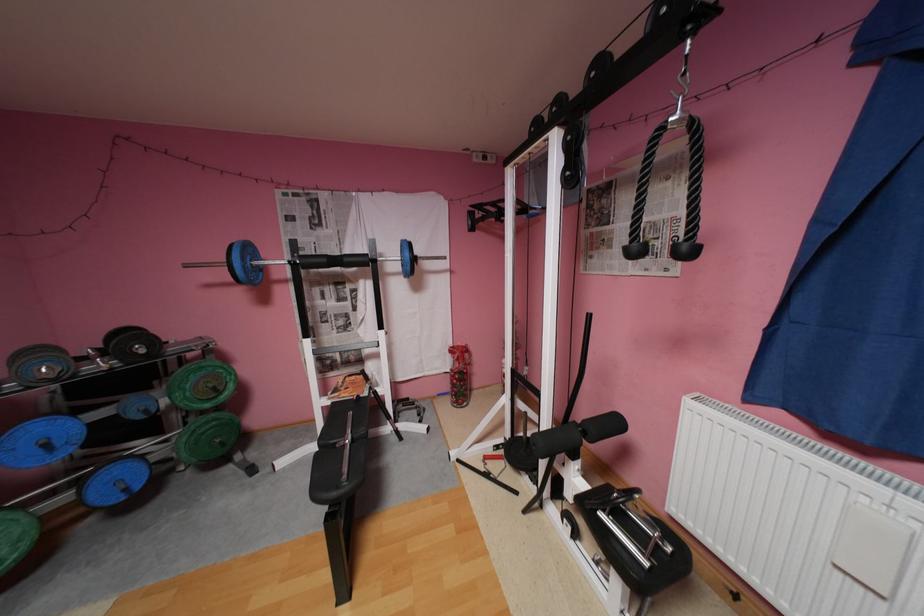
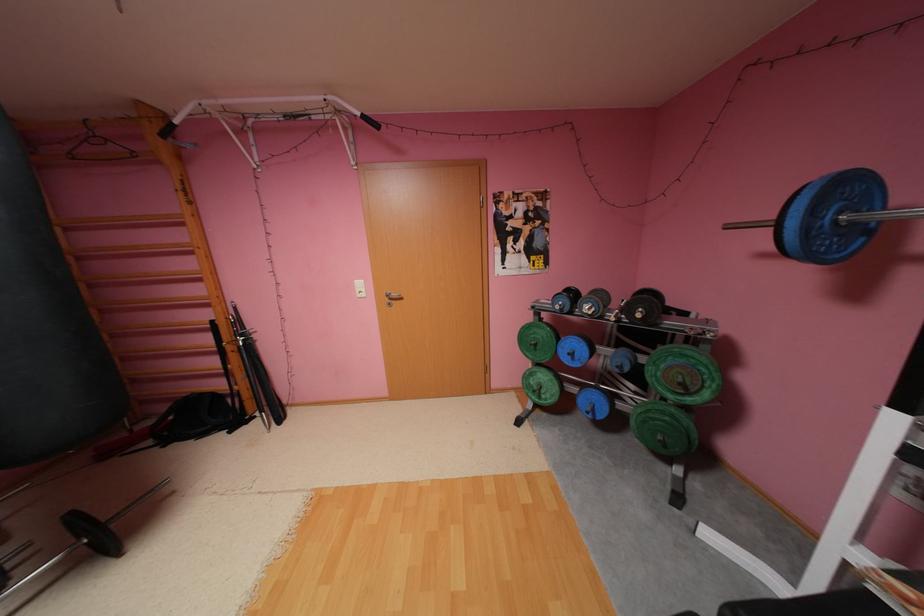
In the second image, find the point that corresponds to pixel 152 351 in the first image.

(648, 315)